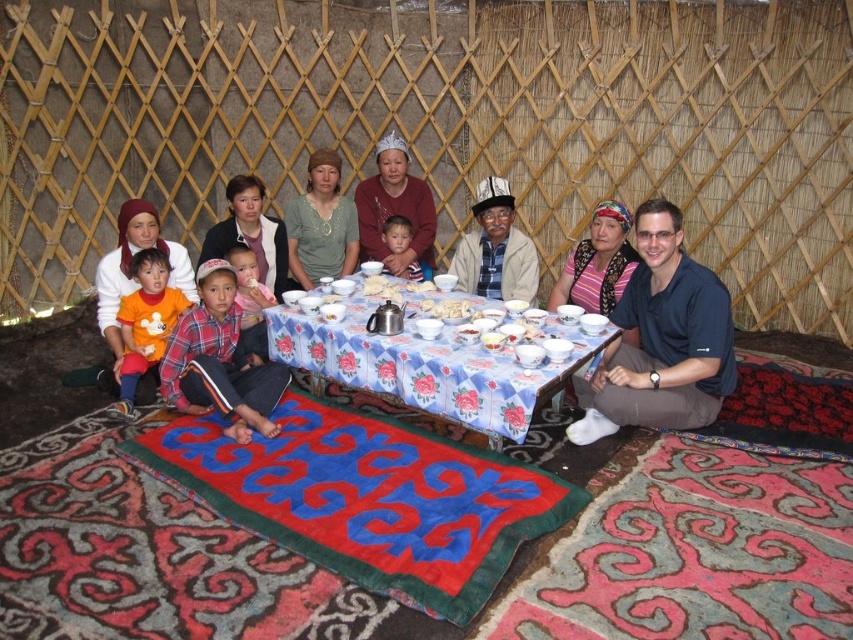
Does point (138, 256) come farther from viewer compared to point (405, 224)?

No.

Is orange cotton shirt at lower left to the right of smooth skin child at center from the viewer's perspective?

Incorrect, orange cotton shirt at lower left is not on the right side of smooth skin child at center.

Which is behind, point (166, 337) or point (412, 253)?

Point (412, 253)

Locate an element on the screen. orange cotton shirt at lower left is located at coordinates 144,323.

Does blue shirt at center have a larger size compared to orange cotton shirt at lower left?

Yes.

Does blue shirt at center have a greater width compared to orange cotton shirt at lower left?

Yes, blue shirt at center is wider than orange cotton shirt at lower left.

This screenshot has height=640, width=853. What do you see at coordinates (660, 340) in the screenshot?
I see `blue shirt at center` at bounding box center [660, 340].

The width and height of the screenshot is (853, 640). Identify the location of blue shirt at center. (660, 340).

Which is above, plaid fabric shirt at center or matte silver tiara at center?

matte silver tiara at center is above.

Does point (190, 388) come farther from viewer compared to point (424, 196)?

No.

This screenshot has width=853, height=640. I want to click on plaid fabric shirt at center, so click(219, 362).